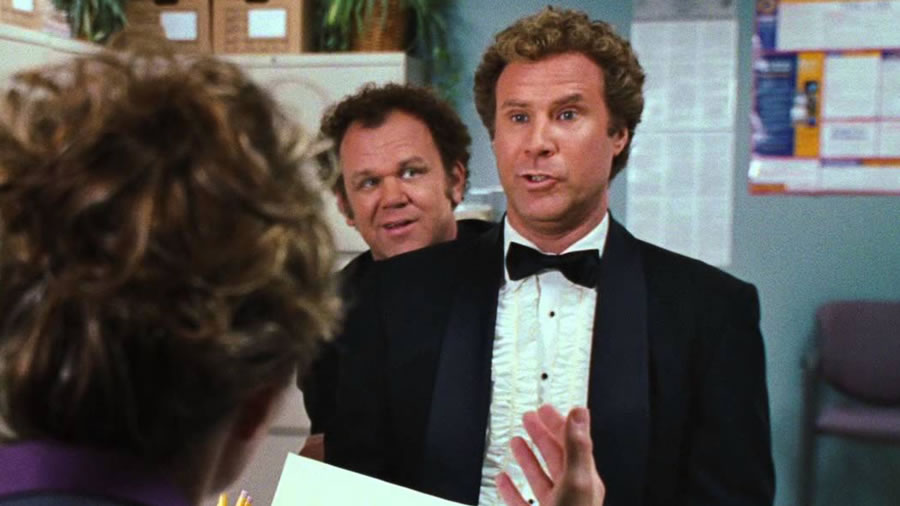
The height and width of the screenshot is (506, 900). Identify the location of purple office chair. (883, 394).